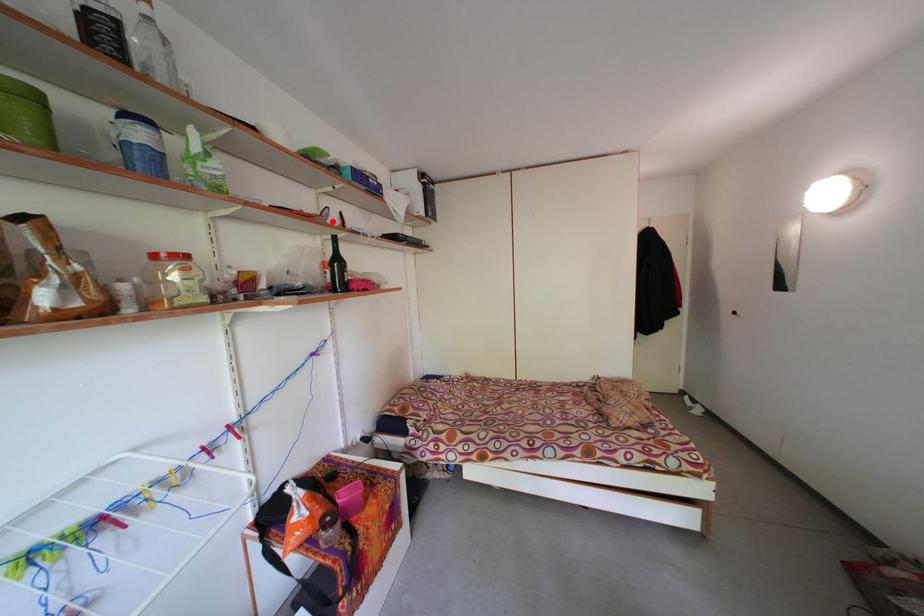
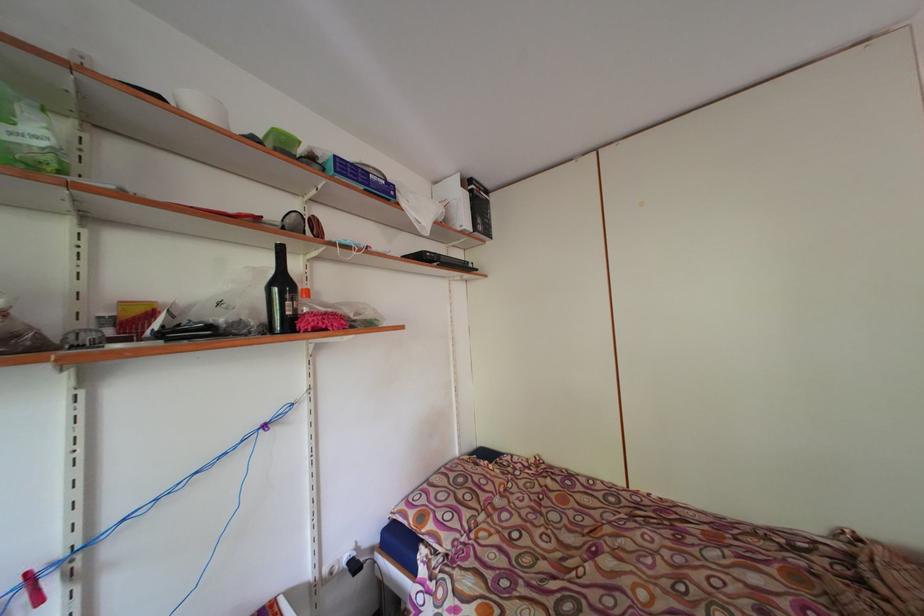
Find the pixel in the second image that matches the highlighted location in the first image.

(296, 227)